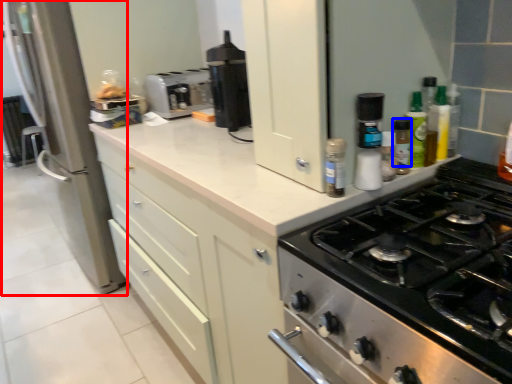
Question: Which object is further to the camera taking this photo, glass door (highlighted by a red box) or bottle (highlighted by a blue box)?

Choices:
 (A) glass door
 (B) bottle

Answer: (A)